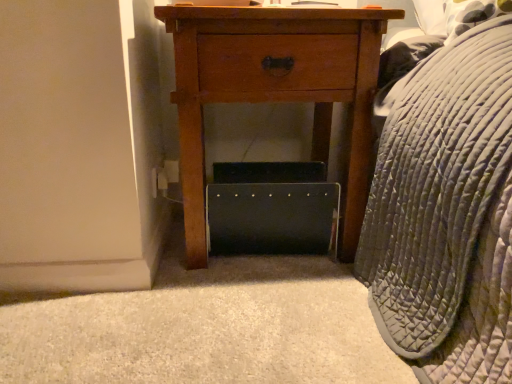
Locate an element on the screen. The image size is (512, 384). wooden nightstand at center is located at coordinates (275, 89).

The height and width of the screenshot is (384, 512). What do you see at coordinates (275, 89) in the screenshot? I see `wooden nightstand at center` at bounding box center [275, 89].

The image size is (512, 384). In order to click on wooden nightstand at center in this screenshot , I will do `click(275, 89)`.